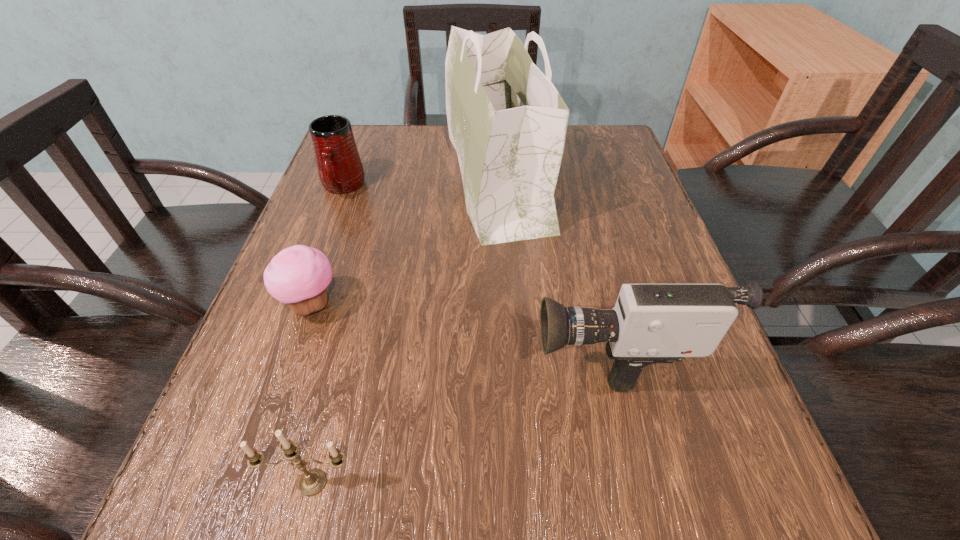
Find the location of a particular element. object at the near left corner is located at coordinates (313, 481).

You are a GUI agent. You are given a task and a screenshot of the screen. Output one action in this format:
    pyautogui.click(x=<x>, y=<y>)
    Task: Click on the vacant space at the far edge
    
    Given the screenshot: What is the action you would take?
    pyautogui.click(x=398, y=165)

The image size is (960, 540). In the image, there is a desktop. Identify the location of free space at the left edge. (366, 212).

The image size is (960, 540). What are the coordinates of `free space at the right edge of the desktop` in the screenshot? It's located at (636, 207).

Find the location of `vacant space at the far right corner of the desktop`. vacant space at the far right corner of the desktop is located at coordinates (578, 142).

At what (x,y) coordinates should I click in order to perform the action: click on free location at the near right corner of the desktop. Please return your answer as a coordinate pair (x, y). Looking at the image, I should click on (671, 477).

Where is `free spot between the mug and the candle`? free spot between the mug and the candle is located at coordinates (327, 335).

At what (x,y) coordinates should I click in order to perform the action: click on empty location between the cupcake and the fourth shortest object. Please return your answer as a coordinate pair (x, y). Looking at the image, I should click on (462, 327).

The width and height of the screenshot is (960, 540). I want to click on free space between the cupcake and the mug, so click(x=327, y=246).

The height and width of the screenshot is (540, 960). What are the coordinates of `free space between the mug and the shortest object` in the screenshot? It's located at [x=327, y=246].